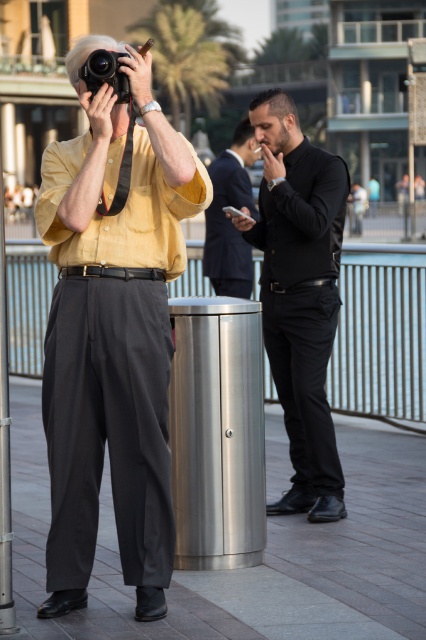
Between black matte shirt at center and matte black camera at upper left, which one appears on the left side from the viewer's perspective?

From the viewer's perspective, matte black camera at upper left appears more on the left side.

Consider the image. Is black matte shirt at center bigger than matte black camera at upper left?

Correct, black matte shirt at center is larger in size than matte black camera at upper left.

Find the location of a particular element. black matte shirt at center is located at coordinates (299, 294).

Which of these two, black matte shirt at center or black suit at right, stands taller?

black matte shirt at center is taller.

Who is more distant from viewer, (294, 140) or (239, 266)?

The point (239, 266) is more distant.

Where is `black matte shirt at center`? The width and height of the screenshot is (426, 640). black matte shirt at center is located at coordinates (299, 294).

Is the position of matte yellow shirt at center more distant than that of black suit at right?

No.

Between point (112, 406) and point (227, 232), which one is positioned behind?

Point (227, 232)

Locate an element on the screen. The height and width of the screenshot is (640, 426). matte yellow shirt at center is located at coordinates (112, 333).